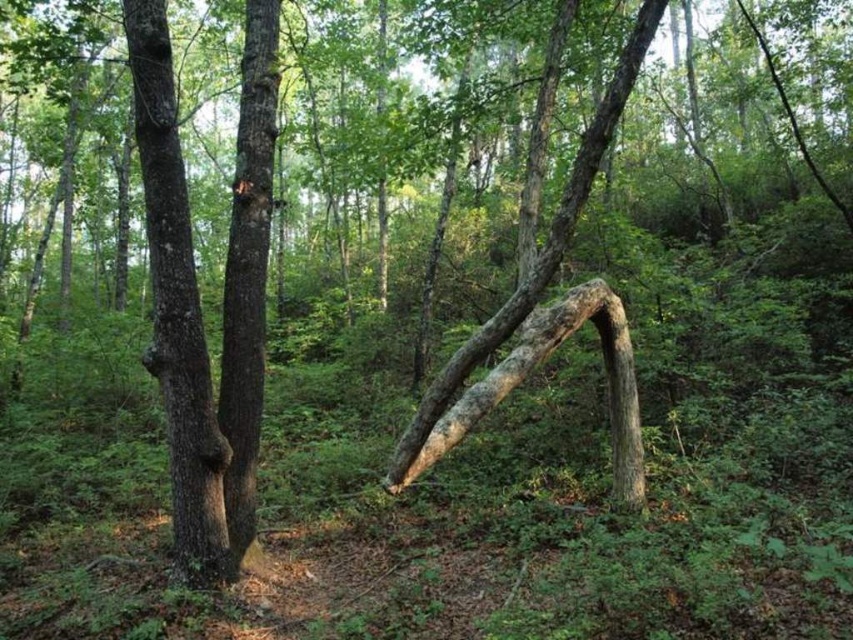
Question: Is brown rough bark tree trunk at left closer to camera compared to smooth brown tree trunk at center?

Choices:
 (A) yes
 (B) no

Answer: (A)

Question: Considering the relative positions of brown rough bark tree trunk at left and smooth brown tree trunk at center in the image provided, where is brown rough bark tree trunk at left located with respect to smooth brown tree trunk at center?

Choices:
 (A) below
 (B) above

Answer: (A)

Question: Which object is closer to the camera taking this photo?

Choices:
 (A) smooth brown tree trunk at center
 (B) brown rough bark tree trunk at left

Answer: (B)

Question: Which object appears farthest from the camera in this image?

Choices:
 (A) smooth brown tree trunk at center
 (B) brown rough bark tree trunk at left

Answer: (A)

Question: Is brown rough bark tree trunk at left further to the viewer compared to smooth brown tree trunk at center?

Choices:
 (A) yes
 (B) no

Answer: (B)